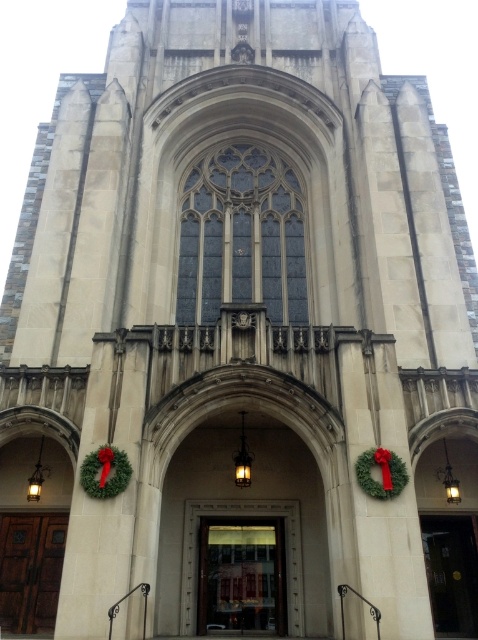
You are a GUI agent. You are given a task and a screenshot of the screen. Output one action in this format:
    pyautogui.click(x=<x>, y=<y>)
    Task: Click on the matte brown door at center
    
    Given the screenshot: What is the action you would take?
    pyautogui.click(x=452, y=572)

From the picture: Between matte brown door at center and green matte wreath at lower center, which one appears on the right side from the viewer's perspective?

matte brown door at center

Between point (446, 609) and point (398, 467), which one is positioned behind?

The point (446, 609) is behind.

This screenshot has height=640, width=478. Find the location of `matte brown door at center`. matte brown door at center is located at coordinates (452, 572).

The image size is (478, 640). What do you see at coordinates (241, 576) in the screenshot?
I see `wooden door at center` at bounding box center [241, 576].

Find the location of a particular element. Image resolution: width=478 pixels, height=640 pixels. wooden door at center is located at coordinates (241, 576).

Find the location of a particular element. Image resolution: width=478 pixels, height=640 pixels. wooden door at center is located at coordinates (241, 576).

Is wooden door at center to the left of wooden door at lower left from the viewer's perspective?

Incorrect, wooden door at center is not on the left side of wooden door at lower left.

Can you confirm if wooden door at center is smaller than wooden door at lower left?

Actually, wooden door at center might be larger than wooden door at lower left.

You are a GUI agent. You are given a task and a screenshot of the screen. Output one action in this format:
    pyautogui.click(x=<x>, y=<y>)
    Task: Click on the wooden door at center
    
    Given the screenshot: What is the action you would take?
    pyautogui.click(x=241, y=576)

Identify the location of wooden door at center. (241, 576).